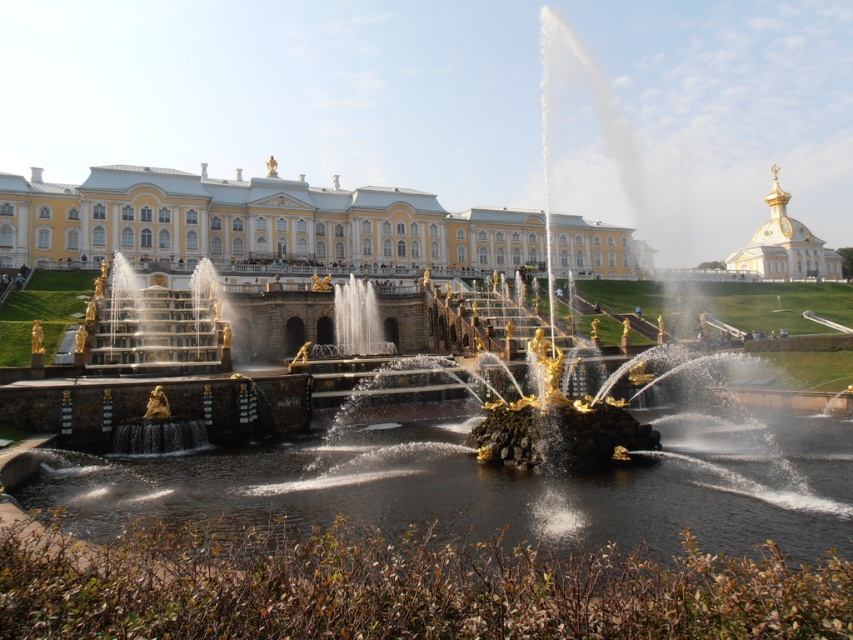
Question: Is yellow/white marble palace at center positioned behind gold plated dome at upper right?

Choices:
 (A) yes
 (B) no

Answer: (B)

Question: Can you confirm if clear water at fountain center is positioned above gold plated dome at upper right?

Choices:
 (A) no
 (B) yes

Answer: (A)

Question: Considering the real-world distances, which object is farthest from the gold plated dome at upper right?

Choices:
 (A) yellow/white marble palace at center
 (B) clear water at fountain center

Answer: (B)

Question: In this image, where is clear water at fountain center located relative to yellow/white marble palace at center?

Choices:
 (A) right
 (B) left

Answer: (A)

Question: Which of these objects is positioned closest to the yellow/white marble palace at center?

Choices:
 (A) gold plated dome at upper right
 (B) clear water at fountain center

Answer: (B)

Question: Estimate the real-world distances between objects in this image. Which object is farther from the gold plated dome at upper right?

Choices:
 (A) yellow/white marble palace at center
 (B) clear water at fountain center

Answer: (B)